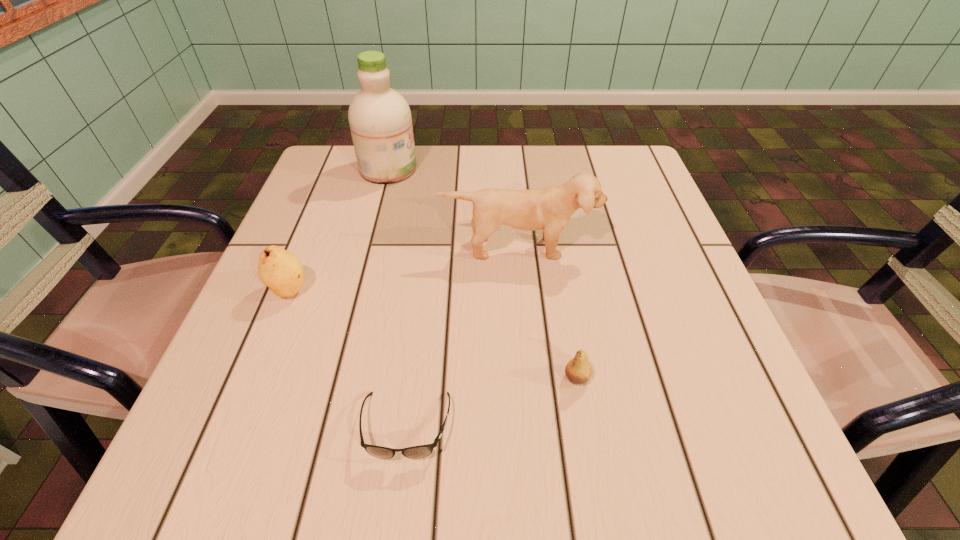
You are a GUI agent. You are given a task and a screenshot of the screen. Output one action in this format:
    pyautogui.click(x=<x>, y=<y>)
    Task: Click on the empty location between the left pear and the fourth farthest object
    The height and width of the screenshot is (540, 960).
    Given the screenshot: What is the action you would take?
    pyautogui.click(x=433, y=334)

Identify the location of empty location between the right pear and the puppy. Image resolution: width=960 pixels, height=540 pixels. (547, 313).

Identify the location of vacant space in between the second farthest object and the right pear. (547, 313).

This screenshot has width=960, height=540. Identify the location of vacant area that lies between the fourth farthest object and the tallest object. (483, 273).

You are a GUI agent. You are given a task and a screenshot of the screen. Output one action in this format:
    pyautogui.click(x=<x>, y=<y>)
    Task: Click on the free space between the puppy and the third nearest object
    
    Given the screenshot: What is the action you would take?
    pyautogui.click(x=403, y=269)

Identify which object is the fourth closest to the nearer pear. Please provide its 2D coordinates. Your answer should be formatted as a tuple, i.e. [(x, y)], where the tuple contains the x and y coordinates of a point satisfying the conditions above.

[(380, 121)]

Where is `object that is the third closest one to the right pear`? The width and height of the screenshot is (960, 540). object that is the third closest one to the right pear is located at coordinates (280, 270).

Where is `blank space that satisfies the following two spatial constraints: 1. on the back side of the second nearest object; 2. on the front label of the farthest object`? blank space that satisfies the following two spatial constraints: 1. on the back side of the second nearest object; 2. on the front label of the farthest object is located at coordinates (540, 168).

Identify the location of vacant space that satisfies the following two spatial constraints: 1. on the front label of the right pear; 2. on the right side of the tallest object. The height and width of the screenshot is (540, 960). (333, 377).

Locate an element on the screen. Image resolution: width=960 pixels, height=540 pixels. free space that satisfies the following two spatial constraints: 1. on the front label of the farthest object; 2. on the back side of the right pear is located at coordinates (333, 377).